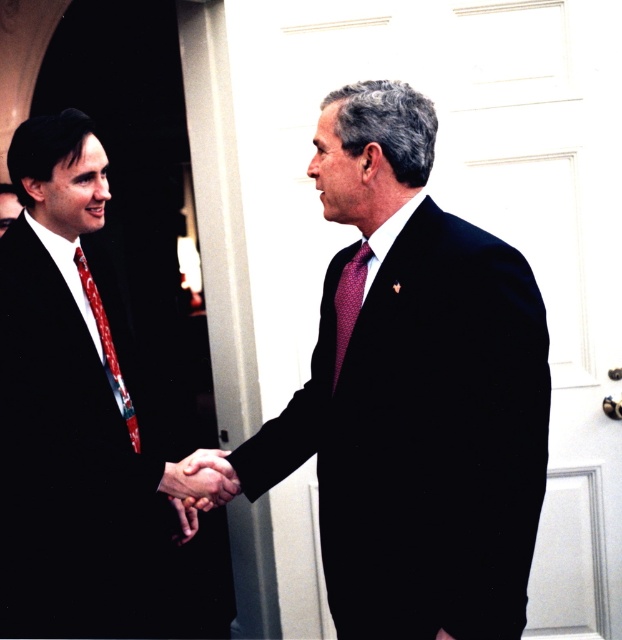
You are a photographer setting up for a formal event. You need to ensure that the matte black suit at center and the smooth skin handshake at center are both clearly visible in your photo. Given their sizes, which object should you focus on to ensure both are in frame without cropping?

The matte black suit at center is larger in size than the smooth skin handshake at center. To ensure both are in frame without cropping, focus on the larger object, the matte black suit at center, and adjust the camera angle so it accommodates its size while still capturing the smaller smooth skin handshake at center.

You are a photographer setting up for a formal event. You need to position a spotlight so that it illuminates both the matte black suit at center and the maroon textured tie at center. Given their positions, which object should the spotlight be angled towards first to ensure both are properly lit?

The spotlight should first be angled towards the matte black suit at center since it is positioned on the right side of the maroon textured tie at center, allowing the light to naturally spread to both objects.

You are a photographer setting up for a formal event. You need to position a light source between the matte black suit at center and the smooth skin handshake at center. Given the distance between them, what is the minimum length of the light stand pole you should use to ensure it can reach from one to the other?

The distance between the matte black suit at center and the smooth skin handshake at center is 15.28 inches. Therefore, the minimum length of the light stand pole needed should be at least 15.28 inches to span the gap between them.